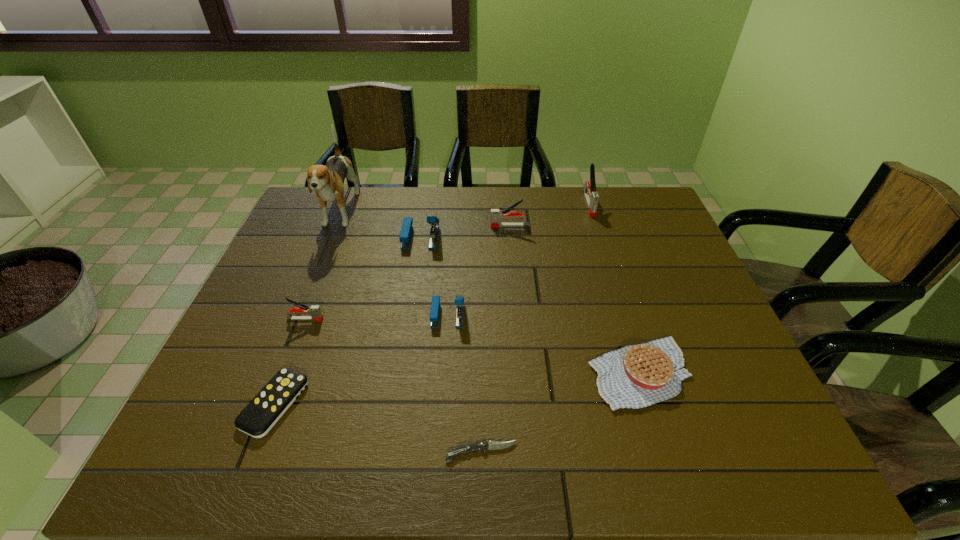
At what (x,y) coordinates should I click in order to perform the action: click on pocketknife positioned at the near edge. Please return your answer as a coordinate pair (x, y). The height and width of the screenshot is (540, 960). Looking at the image, I should click on (484, 446).

Identify the location of puppy positioned at the left edge. The image size is (960, 540). (328, 180).

Where is `stapler situated at the left edge`? stapler situated at the left edge is located at coordinates (316, 315).

At what (x,y) coordinates should I click in order to perform the action: click on remote control that is at the left edge. Please return your answer as a coordinate pair (x, y). Looking at the image, I should click on (268, 406).

You are a GUI agent. You are given a task and a screenshot of the screen. Output one action in this format:
    pyautogui.click(x=<x>, y=<y>)
    Task: Click on the object positioned at the right edge
    The height and width of the screenshot is (540, 960).
    Given the screenshot: What is the action you would take?
    pyautogui.click(x=636, y=376)

Find the location of a particular element. Image resolution: width=960 pixels, height=540 pixels. object that is at the far left corner is located at coordinates (328, 180).

Where is `object at the near left corner`? object at the near left corner is located at coordinates click(x=268, y=406).

What are the coordinates of `vacant region at the far edge of the desktop` in the screenshot? It's located at (350, 226).

This screenshot has width=960, height=540. I want to click on vacant area at the near edge, so click(x=368, y=450).

In the image, there is a desktop. Identify the location of vacant space at the left edge. This screenshot has height=540, width=960. (245, 312).